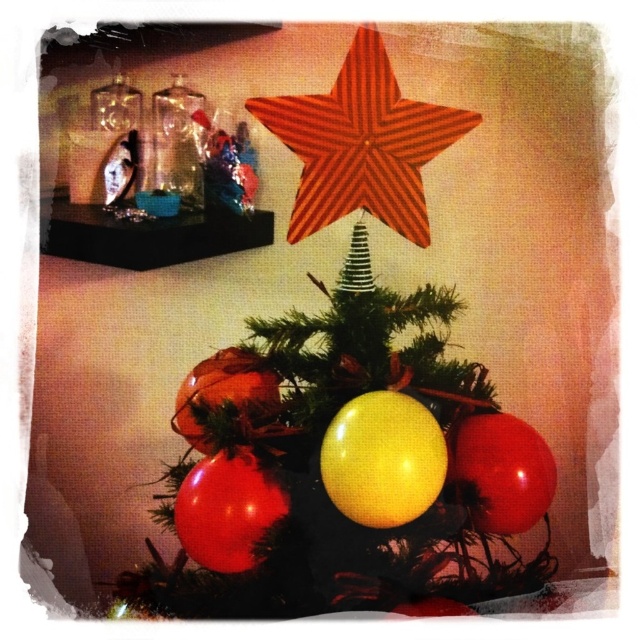
Does glossy red balloon at center have a lesser width compared to shiny metallic ornament at center?

No, glossy red balloon at center is not thinner than shiny metallic ornament at center.

Is point (484, 509) farther from camera compared to point (216, 362)?

No.

Is point (534, 444) behind point (234, 403)?

No.

Find the location of a particular element. The image size is (640, 640). glossy red balloon at center is located at coordinates (499, 472).

Can you confirm if matte red star at upper center is positioned above shiny metallic ornament at center?

Indeed, matte red star at upper center is positioned over shiny metallic ornament at center.

Is matte red star at upper center shorter than shiny metallic ornament at center?

Incorrect, matte red star at upper center's height does not fall short of shiny metallic ornament at center's.

What are the coordinates of `matte red star at upper center` in the screenshot? It's located at (355, 408).

Which is behind, point (426, 477) or point (310, 157)?

Positioned behind is point (310, 157).

Is matte red star at upper center smaller than red striped star at upper center?

Actually, matte red star at upper center might be larger than red striped star at upper center.

Does point (339, 320) come closer to viewer compared to point (349, 200)?

Yes, point (339, 320) is closer to viewer.

Image resolution: width=640 pixels, height=640 pixels. What are the coordinates of `matte red star at upper center` in the screenshot? It's located at (355, 408).